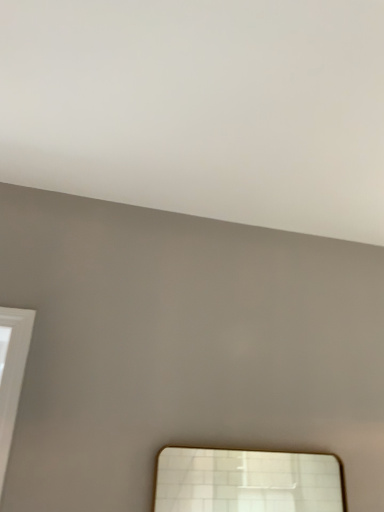
Describe the element at coordinates (247, 481) in the screenshot. I see `clear glass mirror at lower center` at that location.

At what (x,y) coordinates should I click in order to perform the action: click on clear glass mirror at lower center. Please return your answer as a coordinate pair (x, y). This screenshot has width=384, height=512. Looking at the image, I should click on (247, 481).

This screenshot has height=512, width=384. What are the coordinates of `clear glass mirror at lower center` in the screenshot? It's located at (247, 481).